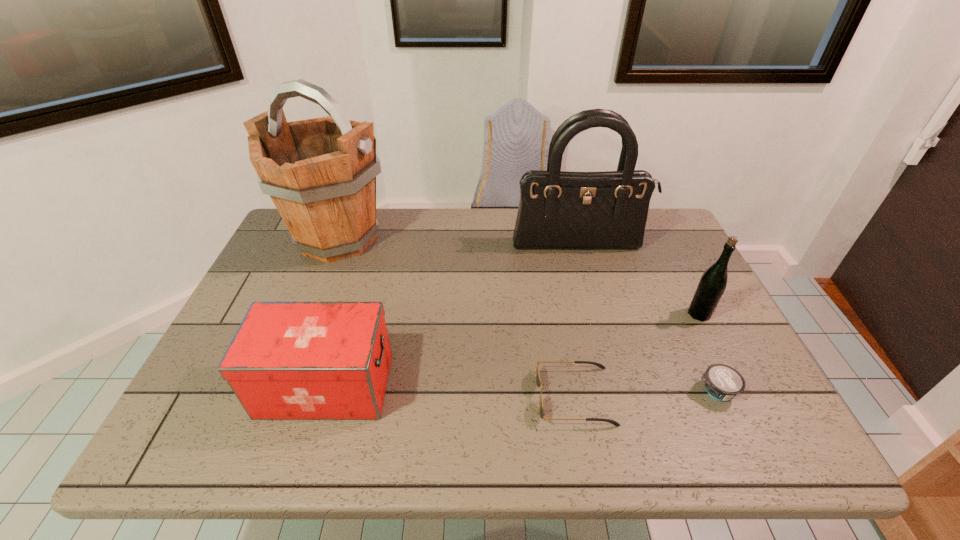
Locate an element on the screen. This screenshot has width=960, height=540. bucket is located at coordinates (320, 173).

Where is `handbag`? handbag is located at coordinates (558, 210).

Locate an element on the screen. This screenshot has width=960, height=540. the third farthest object is located at coordinates (712, 284).

Identify the location of beer bottle. This screenshot has height=540, width=960. (712, 284).

Where is `the fourth tallest object`? Image resolution: width=960 pixels, height=540 pixels. the fourth tallest object is located at coordinates (288, 360).

Where is `sunglasses`? The height and width of the screenshot is (540, 960). sunglasses is located at coordinates (538, 381).

I want to click on yogurt, so click(722, 382).

The height and width of the screenshot is (540, 960). I want to click on blank space located on the front of the bucket, so click(318, 289).

Where is `free space located with an open clasp on the front of the handbag`? The height and width of the screenshot is (540, 960). free space located with an open clasp on the front of the handbag is located at coordinates (600, 323).

Where is `free space located on the left of the fourth nearest object`? The width and height of the screenshot is (960, 540). free space located on the left of the fourth nearest object is located at coordinates (667, 314).